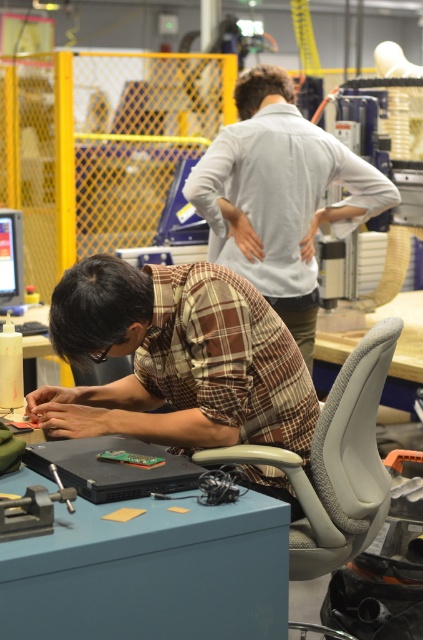
You are a visitor in this workspace and need to determine which object is bigger between the white smooth shirt at upper center and the gray fabric swivel chair at right. Based on the scene, which one is larger?

The white smooth shirt at upper center is larger in size than the gray fabric swivel chair at right according to the description.

You are a visitor in this workspace and need to locate the person wearing the brown plaid shirt at lower left. Based on the scene description, where would you find them relative to the person in the white smooth shirt at upper center?

The brown plaid shirt at lower left is below the white smooth shirt at upper center, so you would find the person in the brown plaid shirt at lower left positioned lower in the image, beneath the individual in the white smooth shirt at upper center.